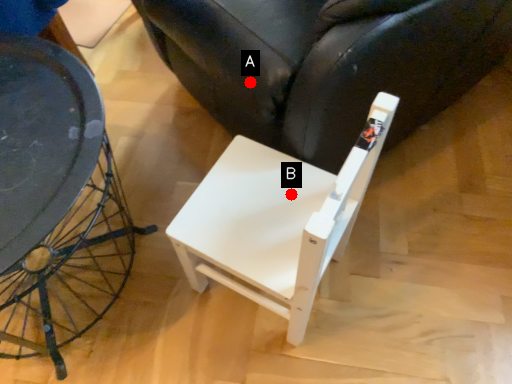
Question: Two points are circled on the image, labeled by A and B beside each circle. Which point is closer to the camera taking this photo?

Choices:
 (A) A is closer
 (B) B is closer

Answer: (B)